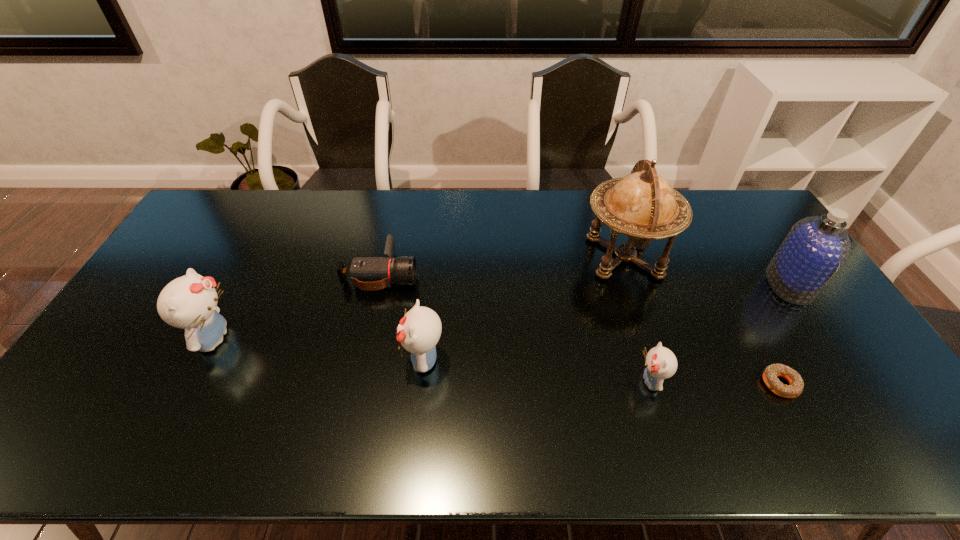
Where is `empty space that is in between the camcorder and the rightmost object`? This screenshot has height=540, width=960. empty space that is in between the camcorder and the rightmost object is located at coordinates (585, 279).

You are a GUI agent. You are given a task and a screenshot of the screen. Output one action in this format:
    pyautogui.click(x=<x>, y=<y>)
    Task: Click on the unoccupied position between the second kitten from left to right and the sixth tallest object
    
    Given the screenshot: What is the action you would take?
    pyautogui.click(x=402, y=316)

At what (x,y) coordinates should I click in order to perform the action: click on free space between the leftmost object and the fourth shortest object. Please return your answer as a coordinate pair (x, y). The width and height of the screenshot is (960, 540). Looking at the image, I should click on (319, 349).

Identify which object is located as the sixth nearest to the leftmost kitten. Please provide its 2D coordinates. Your answer should be formatted as a tuple, i.e. [(x, y)], where the tuple contains the x and y coordinates of a point satisfying the conditions above.

[(816, 247)]

The width and height of the screenshot is (960, 540). Find the location of `object that stands as the sixth closest to the sixth object from left to right`. object that stands as the sixth closest to the sixth object from left to right is located at coordinates (189, 302).

Identify which kitten is the second closest to the shortest object. Please provide its 2D coordinates. Your answer should be formatted as a tuple, i.e. [(x, y)], where the tuple contains the x and y coordinates of a point satisfying the conditions above.

[(419, 330)]

You are a GUI agent. You are given a task and a screenshot of the screen. Output one action in this format:
    pyautogui.click(x=<x>, y=<y>)
    Task: Click on the kitten that can be found as the second closest to the leftmost object
    
    Given the screenshot: What is the action you would take?
    pyautogui.click(x=661, y=363)

This screenshot has width=960, height=540. Find the location of `blank area in the image that satisfies the following two spatial constraints: 1. on the front side of the cleansing agent; 2. on the front-facing side of the leftmost object`. blank area in the image that satisfies the following two spatial constraints: 1. on the front side of the cleansing agent; 2. on the front-facing side of the leftmost object is located at coordinates (826, 339).

At what (x,y) coordinates should I click in order to perform the action: click on blank space that satisfies the following two spatial constraints: 1. on the lens of the cleansing agent; 2. on the right side of the camcorder. Please return your answer as a coordinate pair (x, y). Looking at the image, I should click on (378, 284).

Where is `free region that satisfies the following two spatial constraints: 1. on the lens of the shortest object; 2. on the left side of the camcorder`? This screenshot has width=960, height=540. free region that satisfies the following two spatial constraints: 1. on the lens of the shortest object; 2. on the left side of the camcorder is located at coordinates (357, 384).